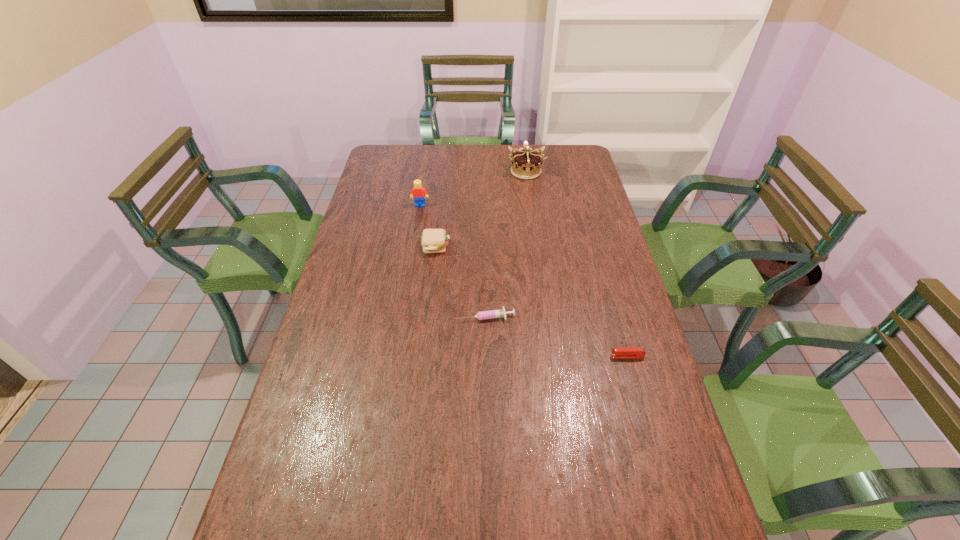
Find the location of `vacant space that's between the Lego and the nearest object`. vacant space that's between the Lego and the nearest object is located at coordinates (523, 281).

Identify the location of vacant space in between the second nearest object and the third tallest object. (460, 281).

Locate an element on the screen. This screenshot has width=960, height=540. vacant space that's between the second farthest object and the third shortest object is located at coordinates (428, 226).

Choose which object is the third nearest neighbor to the nearest object. Please provide its 2D coordinates. Your answer should be formatted as a tuple, i.e. [(x, y)], where the tuple contains the x and y coordinates of a point satisfying the conditions above.

[(526, 164)]

Identify the location of object that ranks as the second closest to the syringe. (619, 352).

Identify the location of free space that satisfies the following two spatial constraints: 1. on the face of the third object from right to left; 2. on the left side of the Lego. (402, 316).

Find the location of a particular element. This screenshot has width=960, height=540. blank area in the image that satisfies the following two spatial constraints: 1. on the face of the syringe; 2. on the left side of the Lego is located at coordinates (402, 316).

What are the coordinates of `vacant space that satisfies the following two spatial constraints: 1. on the back side of the fourth object from left to right; 2. on the left side of the third object from left to right` in the screenshot? It's located at (483, 172).

This screenshot has width=960, height=540. I want to click on free space that satisfies the following two spatial constraints: 1. on the face of the fourth nearest object; 2. on the right side of the third object from right to left, so coord(402,316).